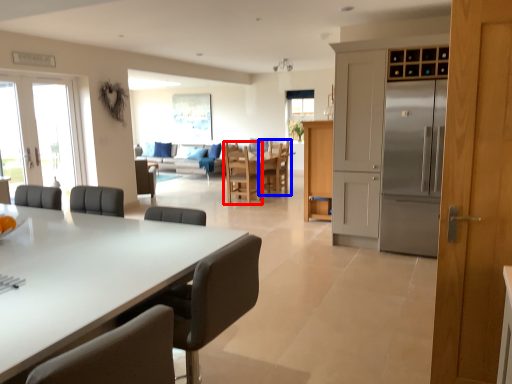
Question: Which point is closer to the camera, chair (highlighted by a red box) or chair (highlighted by a blue box)?

Choices:
 (A) chair
 (B) chair

Answer: (A)